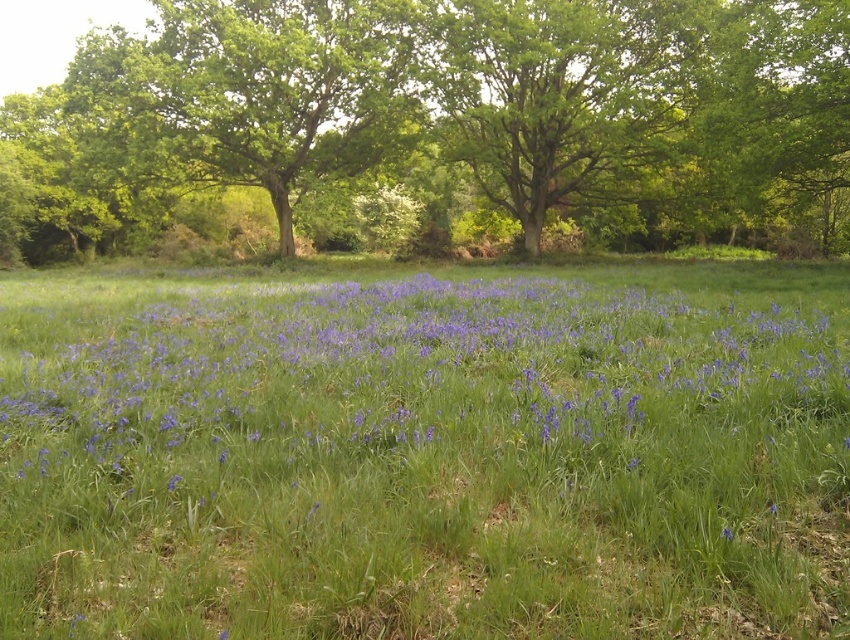
Based on the photo, is purple matte flowers at center thinner than green leafy tree at center?

Correct, purple matte flowers at center's width is less than green leafy tree at center's.

Is purple matte flowers at center taller than green leafy tree at center?

Incorrect, purple matte flowers at center's height is not larger of green leafy tree at center's.

Does point (629, 355) come behind point (191, 64)?

No.

Identify the location of purple matte flowers at center. (417, 406).

Between purple matte flowers at center and purple matte flower at lower right, which one is positioned higher?

purple matte flowers at center is higher up.

Can you confirm if purple matte flowers at center is positioned to the left of purple matte flower at lower right?

Yes, purple matte flowers at center is to the left of purple matte flower at lower right.

Is point (795, 380) less distant than point (732, 536)?

No, (795, 380) is behind (732, 536).

Where is `purple matte flowers at center`? The image size is (850, 640). purple matte flowers at center is located at coordinates (417, 406).

Based on the photo, who is lower down, green leafy tree at center or purple matte flower at lower right?

purple matte flower at lower right

Image resolution: width=850 pixels, height=640 pixels. Identify the location of green leafy tree at center. (442, 118).